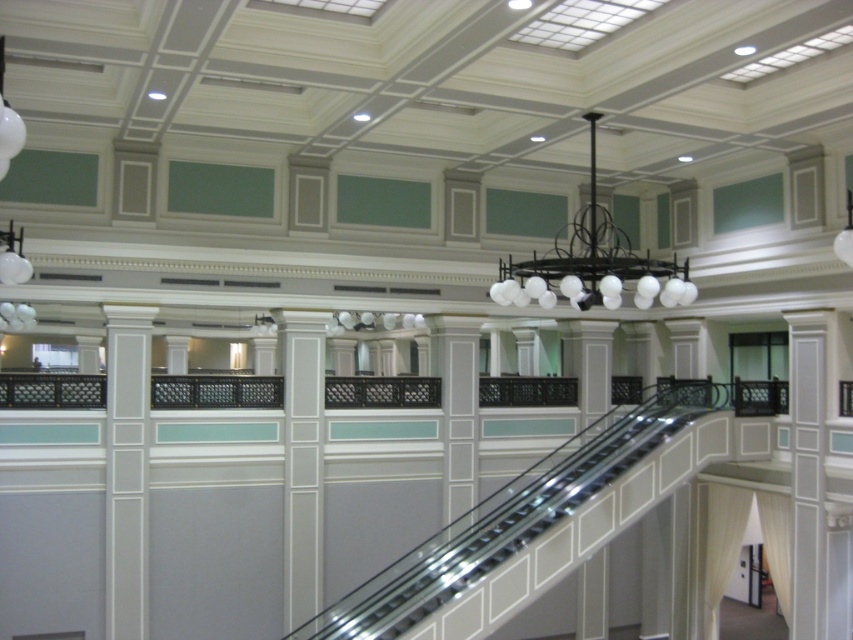
Question: Which point is farther to the camera?

Choices:
 (A) (409, 593)
 (B) (639, 273)

Answer: (A)

Question: Does metallic escalator at center appear under black matte chandelier at upper center?

Choices:
 (A) no
 (B) yes

Answer: (B)

Question: Which point is farther to the camera?

Choices:
 (A) black matte chandelier at upper center
 (B) metallic escalator at center

Answer: (B)

Question: Which point is closer to the camera?

Choices:
 (A) metallic escalator at center
 (B) black matte chandelier at upper center

Answer: (B)

Question: Is metallic escalator at center to the left of black matte chandelier at upper center from the viewer's perspective?

Choices:
 (A) yes
 (B) no

Answer: (A)

Question: Does metallic escalator at center appear over black matte chandelier at upper center?

Choices:
 (A) yes
 (B) no

Answer: (B)